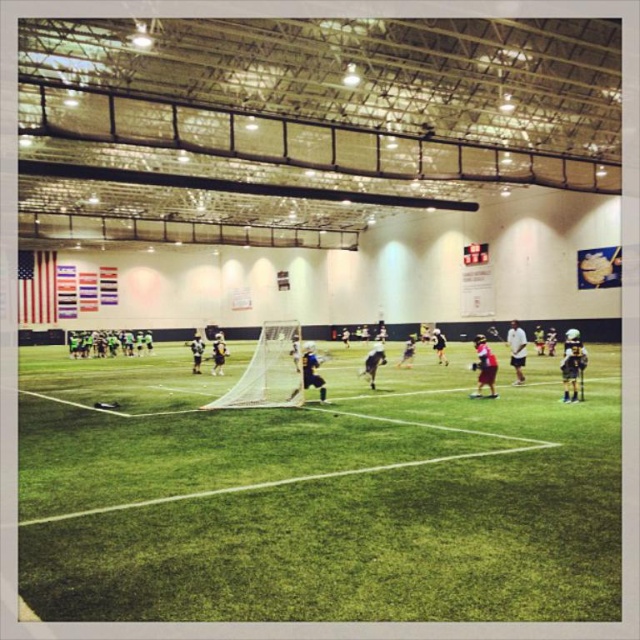
You are a new lacrosse player standing at the edge of the field. You see the green artificial turf at center and the white mesh net at center. Which object is directly above the other?

The white mesh net at center is directly above the green artificial turf at center because the green artificial turf at center is positioned under the white mesh net at center.

You are a photographer standing at the edge of the field. You want to take a photo that includes both the point at coordinates point (352, 504) and point (296, 369). Which point should you focus on first to ensure both are in sharp focus?

You should focus on point (352, 504) first because it is closer to you than point (296, 369), ensuring both points are within the depth of field.

Looking at this image, looking at the lacrosse field, where is the green artificial turf at center in relation to the white mesh net at center?

The green artificial turf at center is to the right of the white mesh net at center.